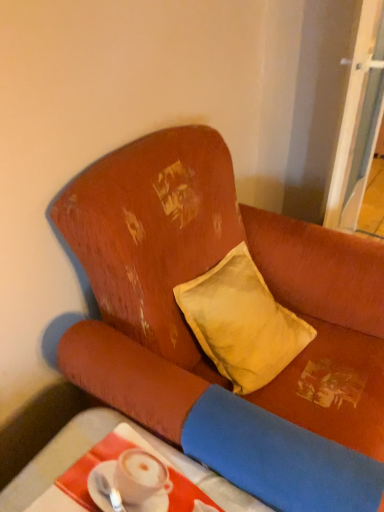
Image resolution: width=384 pixels, height=512 pixels. What do you see at coordinates (358, 120) in the screenshot? I see `transparent glass screen door at upper right` at bounding box center [358, 120].

Image resolution: width=384 pixels, height=512 pixels. Describe the element at coordinates (109, 492) in the screenshot. I see `white glossy spoon at lower left` at that location.

At what (x,y) coordinates should I click in order to perform the action: click on transparent glass screen door at upper right. Please return your answer as a coordinate pair (x, y). The image size is (384, 512). Looking at the image, I should click on (358, 120).

Where is `screen door on the right of the yellow fabric pillow at center`? screen door on the right of the yellow fabric pillow at center is located at coordinates (358, 120).

Which object is wider, transparent glass screen door at upper right or yellow fabric pillow at center?

yellow fabric pillow at center is wider.

Can you tell me how much transparent glass screen door at upper right and yellow fabric pillow at center differ in facing direction?

The facing directions of transparent glass screen door at upper right and yellow fabric pillow at center are 14 degrees apart.

From the image's perspective, is transparent glass screen door at upper right located above or below yellow fabric pillow at center?

transparent glass screen door at upper right is situated higher than yellow fabric pillow at center in the image.

From the image's perspective, which object appears higher, distressed orange fabric couch at upper left or white glossy spoon at lower left?

From the image's view, distressed orange fabric couch at upper left is above.

Does distressed orange fabric couch at upper left have a greater width compared to white glossy spoon at lower left?

Yes, distressed orange fabric couch at upper left is wider than white glossy spoon at lower left.

Considering the sizes of objects distressed orange fabric couch at upper left and white glossy spoon at lower left in the image provided, who is shorter, distressed orange fabric couch at upper left or white glossy spoon at lower left?

Standing shorter between the two is white glossy spoon at lower left.

How different are the orientations of distressed orange fabric couch at upper left and white glossy spoon at lower left in degrees?

There is a 3.45-degree angle between the facing directions of distressed orange fabric couch at upper left and white glossy spoon at lower left.

Is yellow fabric pillow at center to the right of distressed orange fabric couch at upper left from the viewer's perspective?

Incorrect, yellow fabric pillow at center is not on the right side of distressed orange fabric couch at upper left.

Locate an element on the screen. This screenshot has width=384, height=512. pillow on the left side of distressed orange fabric couch at upper left is located at coordinates (242, 322).

From the image's perspective, relative to distressed orange fabric couch at upper left, is yellow fabric pillow at center above or below?

yellow fabric pillow at center is situated higher than distressed orange fabric couch at upper left in the image.

In terms of width, does yellow fabric pillow at center look wider or thinner when compared to distressed orange fabric couch at upper left?

In the image, yellow fabric pillow at center appears to be more narrow than distressed orange fabric couch at upper left.

From a real-world perspective, is yellow fabric pillow at center below smooth white table at lower left?

No, from a real-world perspective, yellow fabric pillow at center is not beneath smooth white table at lower left.

Does yellow fabric pillow at center have a lesser width compared to smooth white table at lower left?

Yes, yellow fabric pillow at center is thinner than smooth white table at lower left.

From the image's perspective, does yellow fabric pillow at center appear lower than smooth white table at lower left?

No, from the image's perspective, yellow fabric pillow at center is not beneath smooth white table at lower left.

How far apart are yellow fabric pillow at center and smooth white table at lower left?

The distance of yellow fabric pillow at center from smooth white table at lower left is 17.35 inches.

Is white glossy spoon at lower left oriented towards transparent glass screen door at upper right?

No, white glossy spoon at lower left is not turned towards transparent glass screen door at upper right.

Does white glossy spoon at lower left appear on the left side of transparent glass screen door at upper right?

Yes, white glossy spoon at lower left is to the left of transparent glass screen door at upper right.

This screenshot has width=384, height=512. What are the coordinates of `tableware located underneath the transparent glass screen door at upper right (from a real-world perspective)` in the screenshot? It's located at (109, 492).

From the image's perspective, between white glossy spoon at lower left and transparent glass screen door at upper right, which one is located above?

transparent glass screen door at upper right appears higher in the image.

Between white glossy spoon at lower left and smooth white table at lower left, which one appears on the right side from the viewer's perspective?

smooth white table at lower left.

Is white glossy spoon at lower left inside the boundaries of smooth white table at lower left, or outside?

white glossy spoon at lower left exists outside the volume of smooth white table at lower left.

Is white glossy spoon at lower left in front of or behind smooth white table at lower left in the image?

Clearly, white glossy spoon at lower left is behind smooth white table at lower left.

From the picture: Can you confirm if white glossy spoon at lower left is taller than smooth white table at lower left?

In fact, white glossy spoon at lower left may be shorter than smooth white table at lower left.

Does point (371, 99) lie behind point (348, 391)?

Yes, point (371, 99) is behind point (348, 391).

Consider the image. Considering the sizes of objects transparent glass screen door at upper right and distressed orange fabric couch at upper left in the image provided, who is smaller, transparent glass screen door at upper right or distressed orange fabric couch at upper left?

transparent glass screen door at upper right is smaller.

Between transparent glass screen door at upper right and distressed orange fabric couch at upper left, which one appears on the right side from the viewer's perspective?

transparent glass screen door at upper right.

From a real-world perspective, which object rests below the other?

In real-world perspective, distressed orange fabric couch at upper left is lower.

Where is `pillow in front of the transparent glass screen door at upper right`? pillow in front of the transparent glass screen door at upper right is located at coordinates (242, 322).

Find the location of a particular element. Image resolution: width=384 pixels, height=512 pixels. studio couch above the white glossy spoon at lower left (from the image's perspective) is located at coordinates (196, 339).

Looking at the image, which one is located further to smooth white table at lower left, distressed orange fabric couch at upper left or yellow fabric pillow at center?

yellow fabric pillow at center lies further to smooth white table at lower left than the other object.

Estimate the real-world distances between objects in this image. Which object is further from yellow fabric pillow at center, transparent glass screen door at upper right or distressed orange fabric couch at upper left?

transparent glass screen door at upper right.

When comparing their distances from distressed orange fabric couch at upper left, does smooth white table at lower left or transparent glass screen door at upper right seem closer?

Based on the image, smooth white table at lower left appears to be nearer to distressed orange fabric couch at upper left.

Looking at the image, which one is located closer to white glossy spoon at lower left, transparent glass screen door at upper right or distressed orange fabric couch at upper left?

The object closer to white glossy spoon at lower left is distressed orange fabric couch at upper left.

In the scene shown: Which object lies further to the anchor point distressed orange fabric couch at upper left, transparent glass screen door at upper right or yellow fabric pillow at center?

Based on the image, transparent glass screen door at upper right appears to be further to distressed orange fabric couch at upper left.

Based on their spatial positions, is distressed orange fabric couch at upper left or yellow fabric pillow at center closer to transparent glass screen door at upper right?

distressed orange fabric couch at upper left is positioned closer to the anchor transparent glass screen door at upper right.

Considering their positions, is yellow fabric pillow at center positioned closer to distressed orange fabric couch at upper left than white glossy spoon at lower left?

yellow fabric pillow at center.

Which object lies further to the anchor point yellow fabric pillow at center, distressed orange fabric couch at upper left or smooth white table at lower left?

Among the two, smooth white table at lower left is located further to yellow fabric pillow at center.

Where is `tableware positioned between distressed orange fabric couch at upper left and yellow fabric pillow at center from near to far`? The height and width of the screenshot is (512, 384). tableware positioned between distressed orange fabric couch at upper left and yellow fabric pillow at center from near to far is located at coordinates (109, 492).

Where is `pillow between distressed orange fabric couch at upper left and transparent glass screen door at upper right from front to back`? Image resolution: width=384 pixels, height=512 pixels. pillow between distressed orange fabric couch at upper left and transparent glass screen door at upper right from front to back is located at coordinates (242, 322).

I want to click on tableware between transparent glass screen door at upper right and smooth white table at lower left in the vertical direction, so click(109, 492).

Where is `studio couch between transparent glass screen door at upper right and white glossy spoon at lower left in the vertical direction`? The image size is (384, 512). studio couch between transparent glass screen door at upper right and white glossy spoon at lower left in the vertical direction is located at coordinates (196, 339).